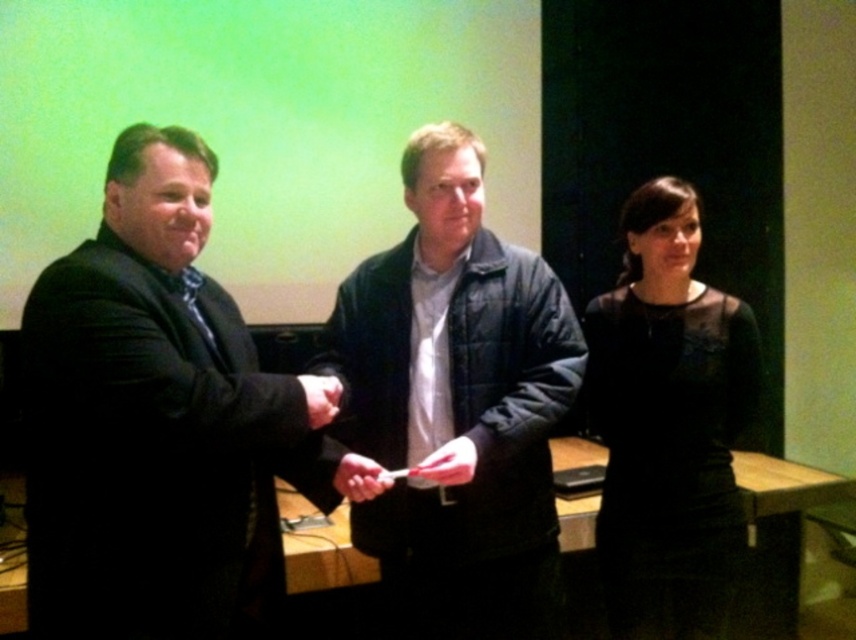
Question: Does black suit at left have a larger size compared to quilted blue jacket at center?

Choices:
 (A) no
 (B) yes

Answer: (A)

Question: Is matte white paper at center above matte black hand at center?

Choices:
 (A) no
 (B) yes

Answer: (A)

Question: Estimate the real-world distances between objects in this image. Which object is closer to the matte white paper at center?

Choices:
 (A) quilted blue jacket at center
 (B) white matte paper at center

Answer: (B)

Question: Which object is closer to the camera taking this photo?

Choices:
 (A) white matte paper at center
 (B) black suit at left

Answer: (B)

Question: Which point appears farthest from the camera in this image?

Choices:
 (A) (367, 474)
 (B) (428, 458)
 (C) (333, 412)

Answer: (B)

Question: Observing the image, what is the correct spatial positioning of black suit at left in reference to matte white paper at center?

Choices:
 (A) below
 (B) above

Answer: (B)